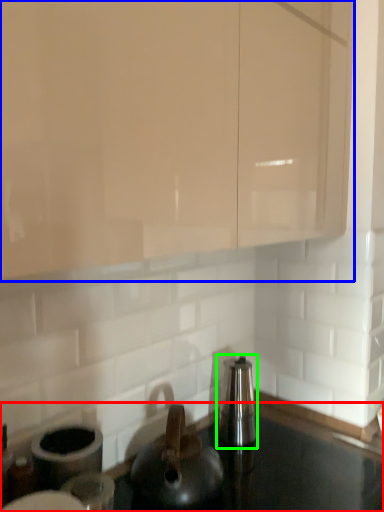
Question: Which is farther away from countertop (highlighted by a red box)? cabinetry (highlighted by a blue box) or appliance (highlighted by a green box)?

Choices:
 (A) cabinetry
 (B) appliance

Answer: (A)